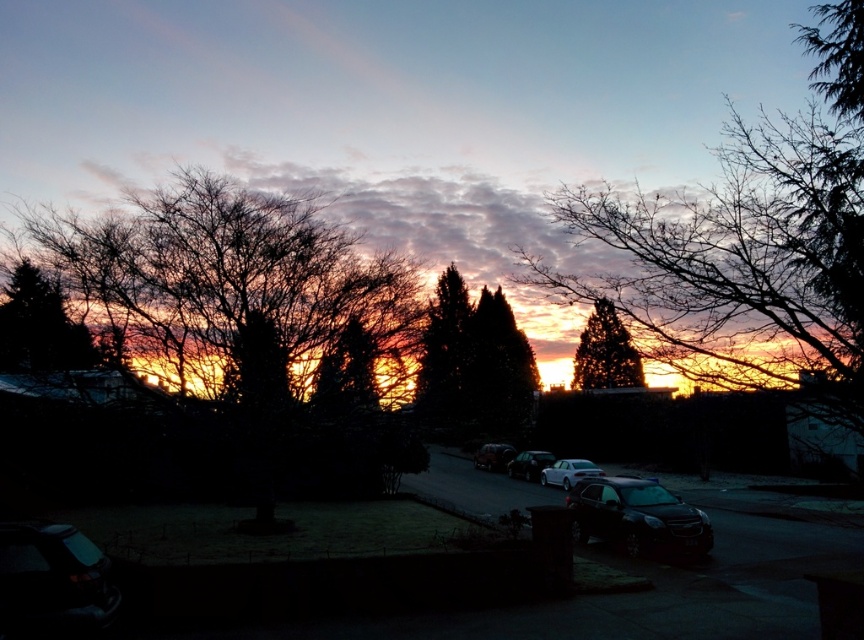
Based on the photo, you are a photographer trying to capture the sunset. You notice the bare branches at upper center and the shiny black car at lower left in your viewfinder. Which object is positioned more to the right in the frame?

The bare branches at upper center is positioned more to the right than the shiny black car at lower left.

You are a photographer trying to capture the sunset. You have two cars in your frame, a satin silver sedan at center and a shiny black car at center. Which car will likely reflect more of the sunset light, and why?

The satin silver sedan at center will likely reflect more sunset light because it has a larger size compared to the shiny black car at center, allowing it to capture and reflect more of the warm glow from the sunset.

You are a parking attendant who needs to fit both the satin silver sedan at center and the shiny black car at center into a parking spot that is 2 meters wide. Based on their widths, can both vehicles fit side by side in the spot?

The satin silver sedan at center might be wider than the shiny black car at center. If the total width of both vehicles exceeds 2 meters, they might not fit side by side. However, without exact measurements, it is uncertain.